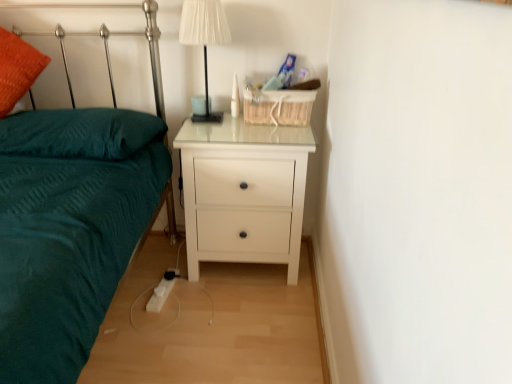
Question: Is point (48, 139) positioned closer to the camera than point (207, 114)?

Choices:
 (A) farther
 (B) closer

Answer: (B)

Question: Which is correct: teal soft pillow at left is inside white fabric lampshade at upper center, or outside of it?

Choices:
 (A) inside
 (B) outside

Answer: (B)

Question: Estimate the real-world distances between objects in this image. Which object is closer to the white fabric lampshade at upper center?

Choices:
 (A) white glossy nightstand at center
 (B) teal fabric bed at left
 (C) teal soft pillow at left

Answer: (A)

Question: Which is nearer to the white fabric lampshade at upper center?

Choices:
 (A) teal fabric bed at left
 (B) teal soft pillow at left
 (C) white glossy nightstand at center

Answer: (C)